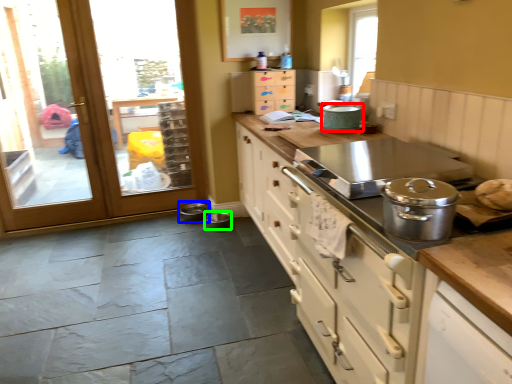
Question: Which object is the closest to the kitchen appliance (highlighted by a red box)? Choose among these: appliance (highlighted by a blue box) or appliance (highlighted by a green box).

Choices:
 (A) appliance
 (B) appliance

Answer: (B)